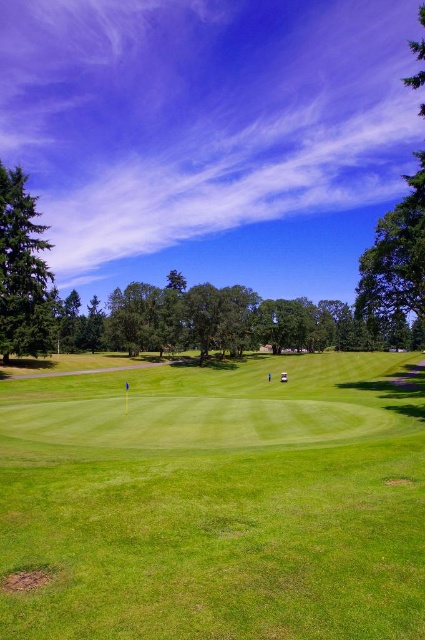
Question: Which object appears closest to the camera in this image?

Choices:
 (A) green textured pine tree at left
 (B) green grassy golf course at center

Answer: (B)

Question: In this image, where is green grassy golf course at center located relative to green textured pine tree at left?

Choices:
 (A) above
 (B) below

Answer: (B)

Question: Which object is positioned closest to the green leafy tree at right?

Choices:
 (A) green grassy golf course at center
 (B) green textured pine tree at left

Answer: (A)

Question: Can you confirm if green leafy tree at right is positioned below green textured pine tree at left?

Choices:
 (A) yes
 (B) no

Answer: (B)

Question: Based on their relative distances, which object is nearer to the green grassy golf course at center?

Choices:
 (A) green textured pine tree at left
 (B) green leafy tree at right

Answer: (A)

Question: Is green grassy golf course at center below green textured pine tree at left?

Choices:
 (A) yes
 (B) no

Answer: (A)